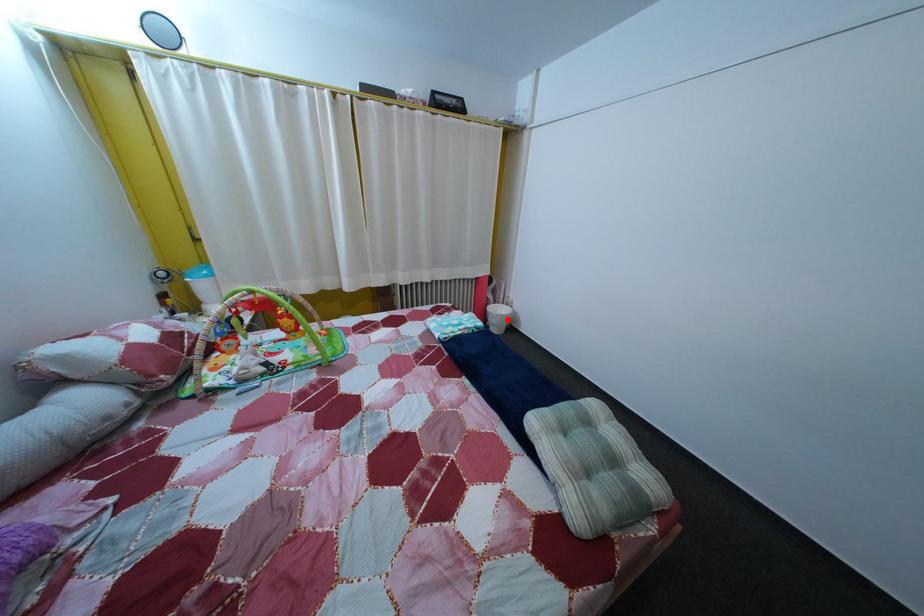
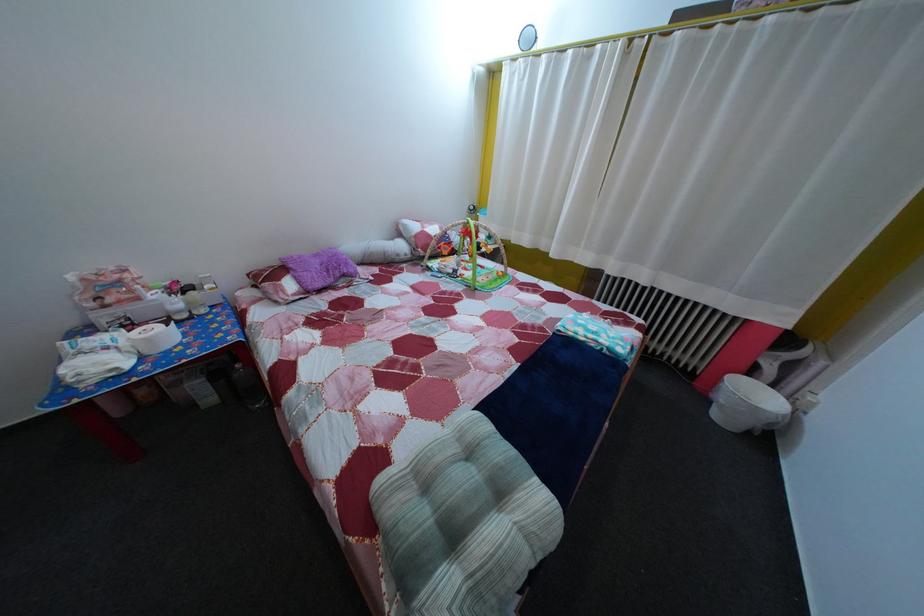
Find the pixel in the second image that matches the highlighted location in the first image.

(760, 402)